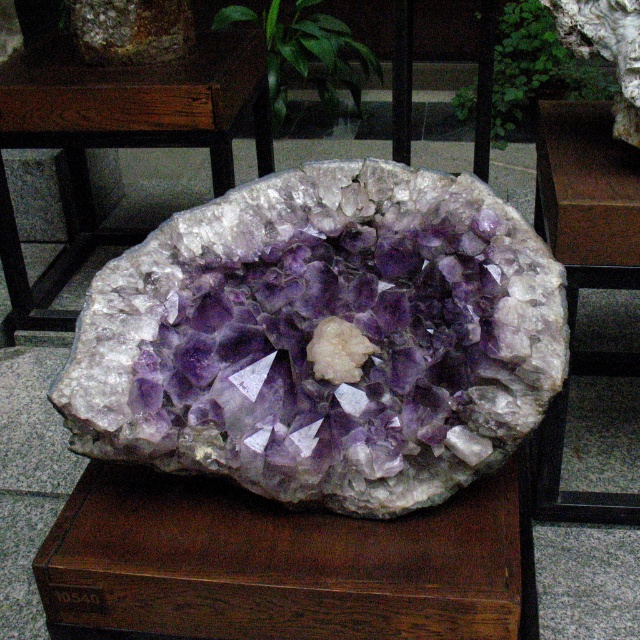
You are a museum curator arranging a display. You have a wooden box at center and a wooden table at center. Which object is lower in height?

The wooden box at center is shorter than the wooden table at center, so the wooden box at center is lower in height.

You are a photographer standing in front of the crystal formation. You want to capture a closeup of the point at coordinates point (144, 381) and point (465, 566). Which point should you focus on first if you want to ensure both are in focus?

You should focus on point (144, 381) first because it is closer to the camera than point (465, 566). This way, adjusting the focus from the closer point to the farther one will help ensure both are in focus.

You are a museum curator checking the display. The purple crystal cluster at center and the wooden table at center are both on display. Which object is shorter in height?

The purple crystal cluster at center is not as tall as the wooden table at center, so the purple crystal cluster at center is shorter in height.